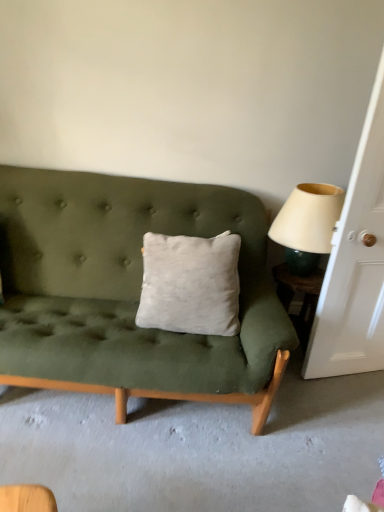
Question: From a real-world perspective, does beige fabric lampshade at right stand above white wood door at right?

Choices:
 (A) yes
 (B) no

Answer: (B)

Question: Is the depth of beige fabric lampshade at right less than that of white wood door at right?

Choices:
 (A) yes
 (B) no

Answer: (B)

Question: Considering the relative positions of beige fabric lampshade at right and white wood door at right in the image provided, is beige fabric lampshade at right behind white wood door at right?

Choices:
 (A) yes
 (B) no

Answer: (A)

Question: Can you confirm if beige fabric lampshade at right is thinner than white wood door at right?

Choices:
 (A) no
 (B) yes

Answer: (A)

Question: Is white wood door at right at the back of beige fabric lampshade at right?

Choices:
 (A) yes
 (B) no

Answer: (B)

Question: Is beige fabric lampshade at right not within white wood door at right?

Choices:
 (A) no
 (B) yes

Answer: (B)

Question: From a real-world perspective, is green glossy side table at right located higher than beige fabric lampshade at right?

Choices:
 (A) no
 (B) yes

Answer: (A)

Question: Is green glossy side table at right outside beige fabric lampshade at right?

Choices:
 (A) no
 (B) yes

Answer: (B)

Question: From the image's perspective, does green glossy side table at right appear higher than beige fabric lampshade at right?

Choices:
 (A) no
 (B) yes

Answer: (A)

Question: Considering the relative sizes of green glossy side table at right and beige fabric lampshade at right in the image provided, is green glossy side table at right shorter than beige fabric lampshade at right?

Choices:
 (A) no
 (B) yes

Answer: (A)

Question: Is green glossy side table at right facing towards beige fabric lampshade at right?

Choices:
 (A) no
 (B) yes

Answer: (A)

Question: Is green glossy side table at right to the right of beige fabric lampshade at right from the viewer's perspective?

Choices:
 (A) no
 (B) yes

Answer: (B)

Question: Is white wood door at right with green glossy side table at right?

Choices:
 (A) yes
 (B) no

Answer: (B)